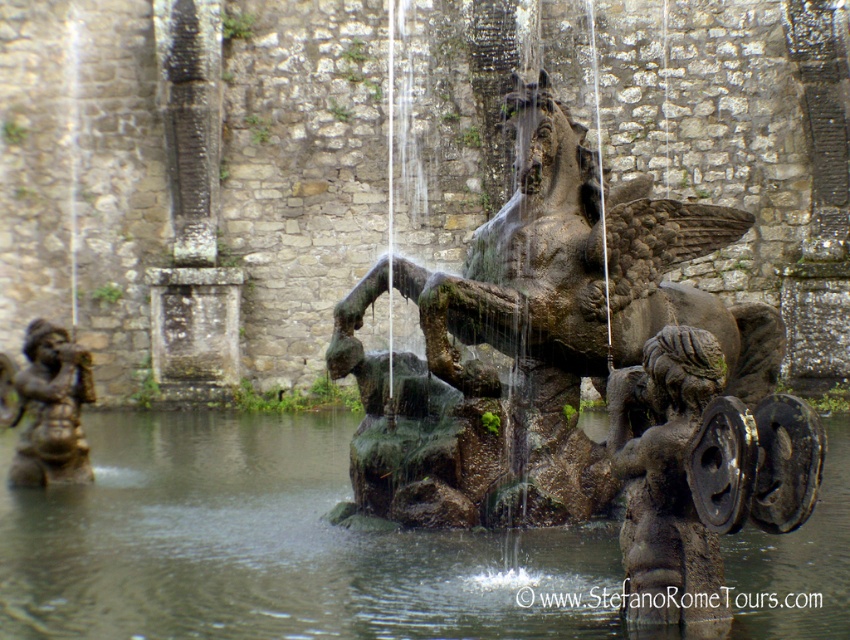
Is greenish stone horse at center above bronze statue at left?

Correct, greenish stone horse at center is located above bronze statue at left.

Consider the image. Can you confirm if greenish stone horse at center is wider than bronze statue at left?

Yes.

Is point (795, 412) closer to viewer compared to point (54, 371)?

Yes.

Where is `greenish stone horse at center`? The image size is (850, 640). greenish stone horse at center is located at coordinates (582, 376).

Who is more distant from viewer, (557, 476) or (190, 412)?

The point (190, 412) is behind.

Does point (664, 413) lie behind point (751, 564)?

That is False.

Where is `greenish stone horse at center`? greenish stone horse at center is located at coordinates (582, 376).

Between point (319, 600) and point (41, 420), which one is positioned in front?

Point (319, 600) is more forward.

The image size is (850, 640). In order to click on green mossy water at center in this screenshot , I will do `click(270, 545)`.

You are a GUI agent. You are given a task and a screenshot of the screen. Output one action in this format:
    pyautogui.click(x=<x>, y=<y>)
    Task: Click on the green mossy water at center
    
    Given the screenshot: What is the action you would take?
    pyautogui.click(x=270, y=545)